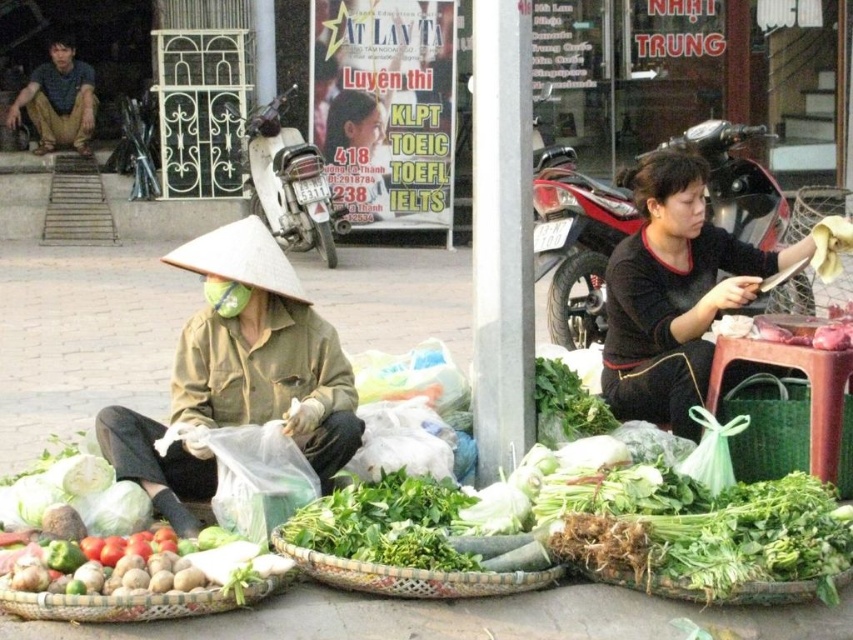
You are a customer looking to buy vegetables from the vendor. You see the bamboo woven basket at center and the matte brown shirt at upper left. Which object is closer to your right side?

The bamboo woven basket at center is to the right of matte brown shirt at upper left, so it is closer to your right side.

You are a customer at this market and want to buy vegetables from the vendor with the matte brown shirt at upper left. You need to reach the green woven basket at lower right to pick your vegetables. Is the basket within your reach from your current position?

The green woven basket at lower right is located below the matte brown shirt at upper left. Since the basket is positioned lower, it should be within reach if you are standing at the vendor area.

In the scene shown: You are a customer looking to buy vegetables from the vendor in the scene. The vendor is wearing a matte brown shirt at upper left and has a bamboo woven basket at center where the vegetables are kept. Can you tell me if the basket is above or below the shirt?

The bamboo woven basket at center is below matte brown shirt at upper left.